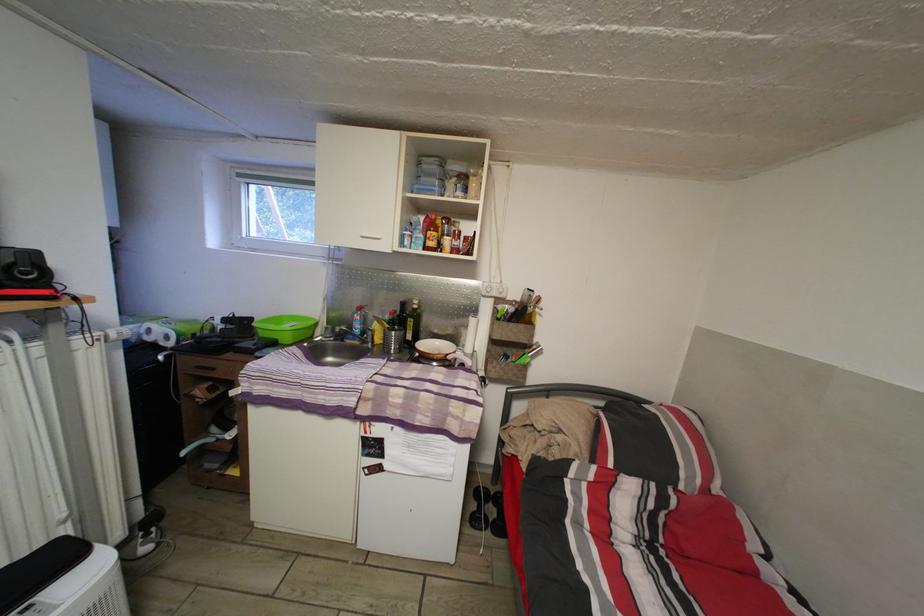
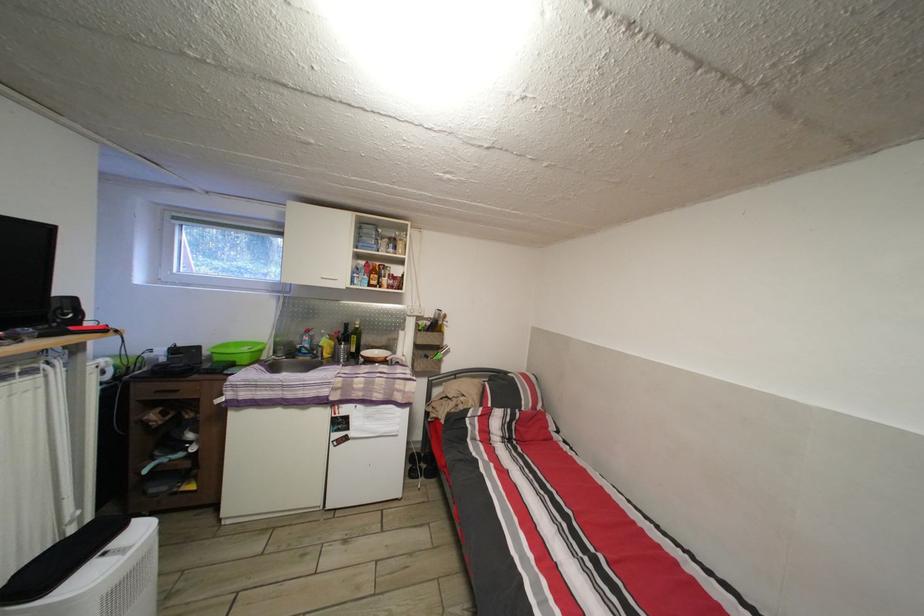
The point at (377, 339) is marked in the first image. Where is the corresponding point in the second image?

(327, 355)